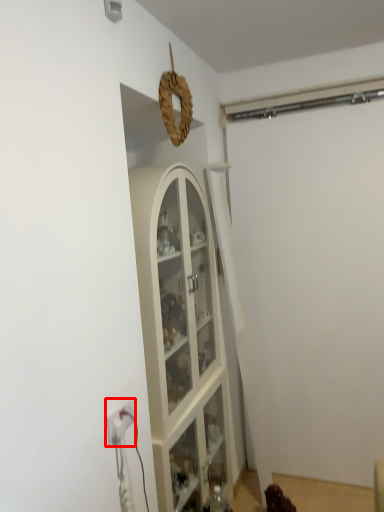
Question: From the image's perspective, what is the correct spatial positioning of electric outlet (annotated by the red box) in reference to garage door?

Choices:
 (A) above
 (B) below

Answer: (B)